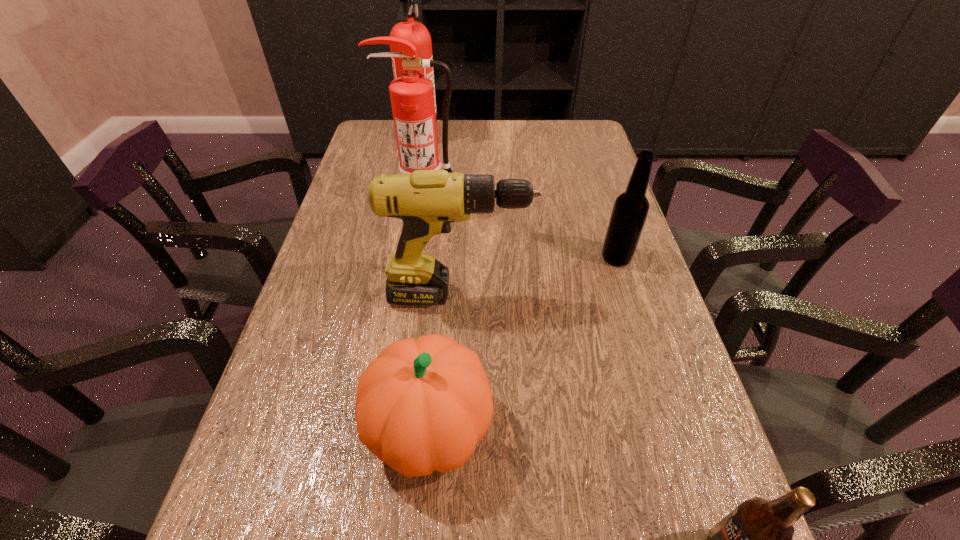
The width and height of the screenshot is (960, 540). I want to click on object that ranks as the second closest to the fifth farthest object, so click(x=756, y=539).

At what (x,y) coordinates should I click in order to perform the action: click on vacant point that satisfies the following two spatial constraints: 1. at the nozzle of the second nearest object; 2. on the right side of the second farthest object. Please return your answer as a coordinate pair (x, y). Image resolution: width=960 pixels, height=540 pixels. Looking at the image, I should click on (396, 428).

Where is `free location that satisfies the following two spatial constraints: 1. at the nozzle of the fifth nearest object; 2. on the right side of the second nearest object`? The width and height of the screenshot is (960, 540). free location that satisfies the following two spatial constraints: 1. at the nozzle of the fifth nearest object; 2. on the right side of the second nearest object is located at coordinates (396, 428).

I want to click on vacant point that satisfies the following two spatial constraints: 1. on the handle side of the farther fire extinguisher; 2. on the left side of the farther beer bottle, so click(x=397, y=258).

The height and width of the screenshot is (540, 960). In order to click on vacant space that satisfies the following two spatial constraints: 1. on the handle side of the pumpkin; 2. on the right side of the farther fire extinguisher in this screenshot , I will do `click(366, 428)`.

The image size is (960, 540). What are the coordinates of `vacant position in the image that satisfies the following two spatial constraints: 1. on the back side of the taller beer bottle; 2. on the handle side of the farthest object` in the screenshot? It's located at (578, 135).